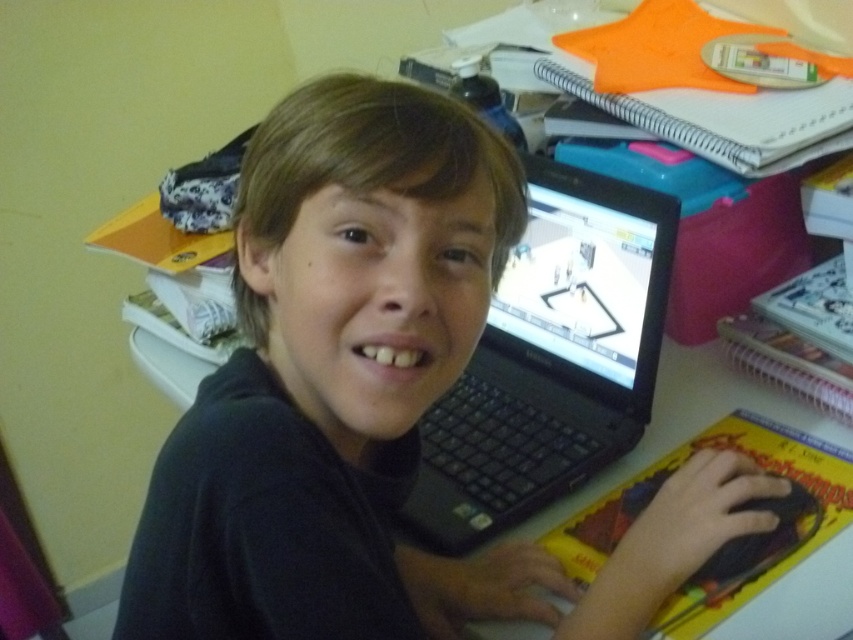
You are organizing the desk items and need to place a new item between the black matte laptop at center and the black plastic laptop at center. Is there enough space between them to fit a 10 cm wide item?

The black matte laptop at center is to the left of the black plastic laptop at center, but the exact distance between them isn not provided. Without knowing the space between them, it is impossible to determine if a 10 cm wide item can fit.

You are a student who needs to place a small sticker exactly at the point with coordinates [373,401] on the black matte laptop at center. Where should you place the sticker on the laptop?

The point with coordinates [373,401] is located on the black matte laptop at center, so you should place the sticker exactly at that point on the laptop.

You are trying to determine which laptop is better for a design project based on their sizes. The scene shows a black matte laptop at center and a black plastic laptop at center. Which one has a larger screen size?

The black matte laptop at center has a larger width than the black plastic laptop at center, so it likely has a larger screen size for the design project.